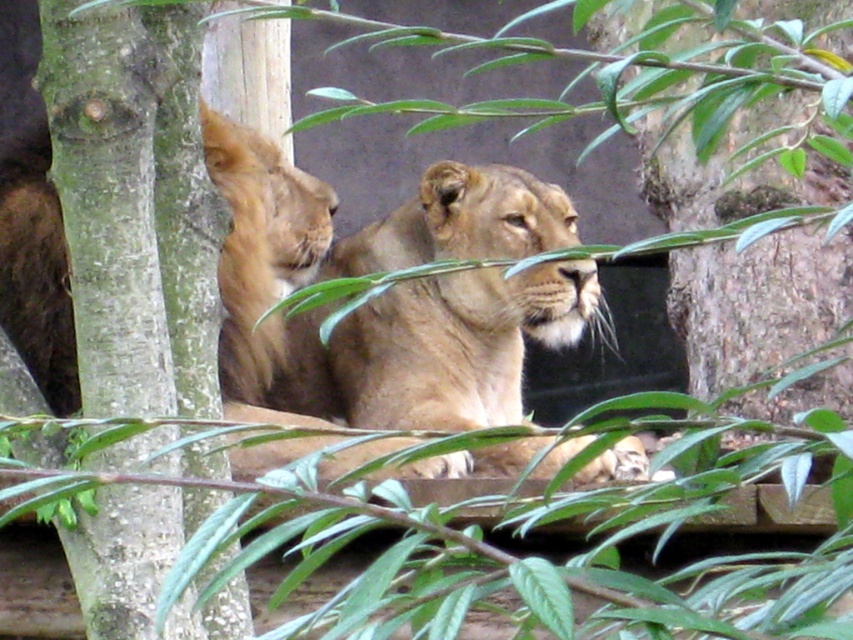
Between green rough bark at left and golden fur lion at center, which one has more height?

green rough bark at left is taller.

From the picture: Can you confirm if green rough bark at left is positioned to the right of golden fur lion at center?

Incorrect, green rough bark at left is not on the right side of golden fur lion at center.

Who is more distant from viewer, (57, 144) or (482, 285)?

The point (482, 285) is behind.

Where is `green rough bark at left`? This screenshot has height=640, width=853. green rough bark at left is located at coordinates (135, 204).